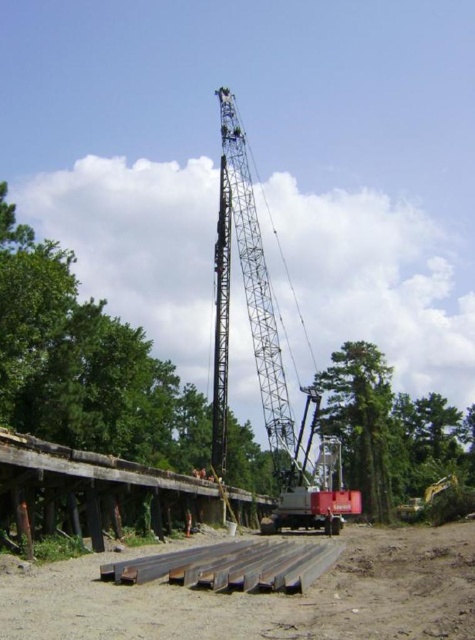
Question: Which of these objects is positioned farthest from the green rough bark tree at center?

Choices:
 (A) metal beams at lower center
 (B) metal at lower center
 (C) metallic gray crane at center

Answer: (B)

Question: Can you confirm if metal beams at lower center is smaller than metal at lower center?

Choices:
 (A) no
 (B) yes

Answer: (A)

Question: Which point appears farthest from the camera in this image?

Choices:
 (A) (363, 472)
 (B) (427, 612)
 (C) (167, 560)

Answer: (A)

Question: Does green rough bark tree at center appear on the right side of metal at lower center?

Choices:
 (A) yes
 (B) no

Answer: (A)

Question: Can you confirm if metallic gray crane at center is bigger than metal at lower center?

Choices:
 (A) yes
 (B) no

Answer: (A)

Question: Based on their relative distances, which object is nearer to the metal beams at lower center?

Choices:
 (A) green rough bark tree at center
 (B) metallic gray crane at center
 (C) metal at lower center

Answer: (C)